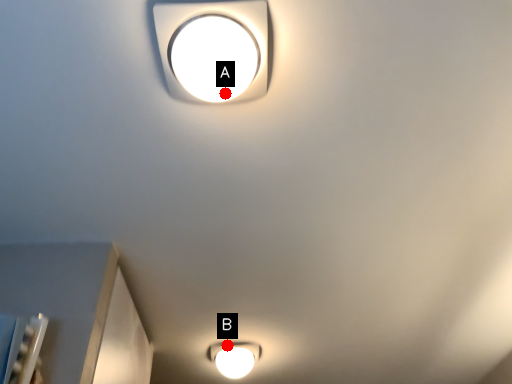
Question: Two points are circled on the image, labeled by A and B beside each circle. Which point is farther to the camera?

Choices:
 (A) A is further
 (B) B is further

Answer: (B)